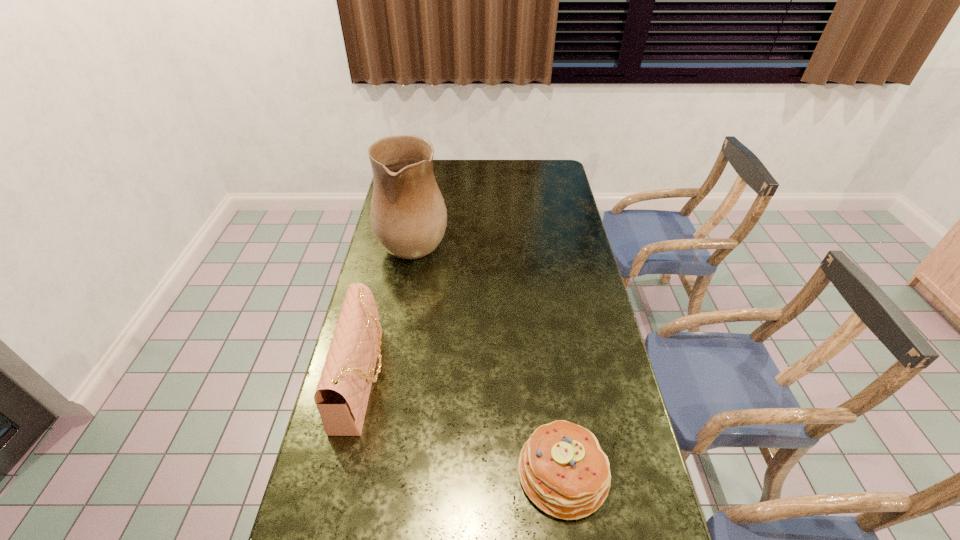
I want to click on vacant area that lies between the handbag and the farthest object, so click(x=389, y=308).

What are the coordinates of `vacant region between the pancake and the cream pitcher` in the screenshot? It's located at (489, 355).

In order to click on vacant area that lies between the handbag and the rightmost object in this screenshot , I will do `click(463, 426)`.

You are a GUI agent. You are given a task and a screenshot of the screen. Output one action in this format:
    pyautogui.click(x=<x>, y=<y>)
    Task: Click on the free area in between the handbag and the rightmost object
    Image resolution: width=960 pixels, height=540 pixels.
    Given the screenshot: What is the action you would take?
    pyautogui.click(x=463, y=426)

Point out which object is positioned as the second nearest to the tallest object. Please provide its 2D coordinates. Your answer should be formatted as a tuple, i.e. [(x, y)], where the tuple contains the x and y coordinates of a point satisfying the conditions above.

[(562, 468)]

At what (x,y) coordinates should I click in order to perform the action: click on the second closest object relative to the cream pitcher. Please return your answer as a coordinate pair (x, y). The height and width of the screenshot is (540, 960). Looking at the image, I should click on (562, 468).

Find the location of `free spot that satisfies the following two spatial constraints: 1. at the spout of the pancake; 2. on the left side of the cream pitcher`. free spot that satisfies the following two spatial constraints: 1. at the spout of the pancake; 2. on the left side of the cream pitcher is located at coordinates (373, 472).

You are a GUI agent. You are given a task and a screenshot of the screen. Output one action in this format:
    pyautogui.click(x=<x>, y=<y>)
    Task: Click on the free space that satisfies the following two spatial constraints: 1. at the spout of the cream pitcher; 2. on the right side of the pancake
    This screenshot has width=960, height=540.
    Given the screenshot: What is the action you would take?
    pyautogui.click(x=373, y=472)

Locate an element on the screen. The height and width of the screenshot is (540, 960). free location that satisfies the following two spatial constraints: 1. on the front-facing side of the second tallest object; 2. on the back side of the shortest object is located at coordinates (342, 472).

Find the location of a particular element. This screenshot has width=960, height=540. free region that satisfies the following two spatial constraints: 1. at the spout of the tallest object; 2. on the right side of the rightmost object is located at coordinates [373, 472].